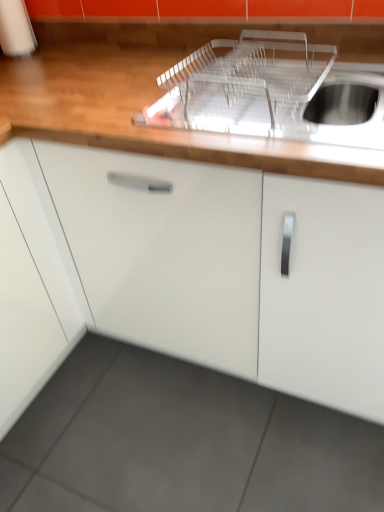
Question: From a real-world perspective, is transparent plastic dish rack at upper center above or below white glossy cabinet at center?

Choices:
 (A) below
 (B) above

Answer: (B)

Question: Considering the positions of transparent plastic dish rack at upper center and white glossy cabinet at center in the image, is transparent plastic dish rack at upper center taller or shorter than white glossy cabinet at center?

Choices:
 (A) short
 (B) tall

Answer: (A)

Question: Based on their relative distances, which object is farther from the transparent plastic dish rack at upper center?

Choices:
 (A) transparent plastic sink at upper right
 (B) white glossy cabinet at center

Answer: (B)

Question: Which object is the farthest from the white glossy cabinet at center?

Choices:
 (A) transparent plastic dish rack at upper center
 (B) transparent plastic sink at upper right

Answer: (B)